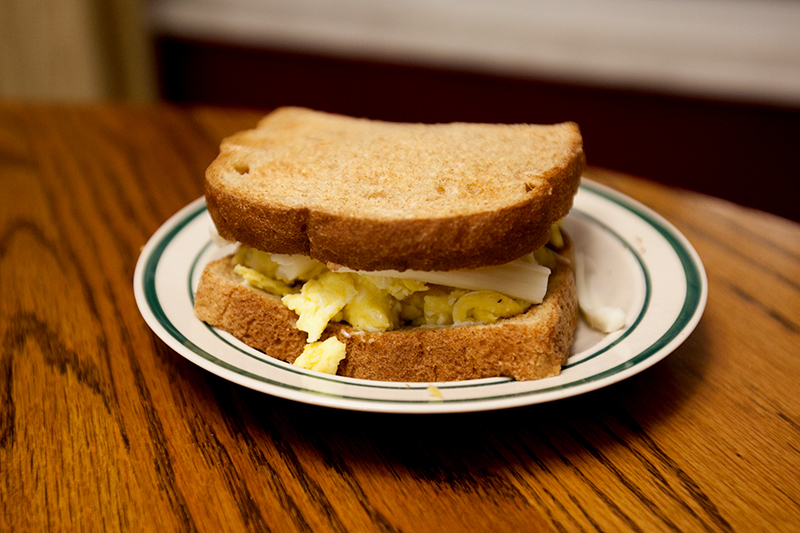
Identify the location of green rim of plate. (x=642, y=306), (x=666, y=338).